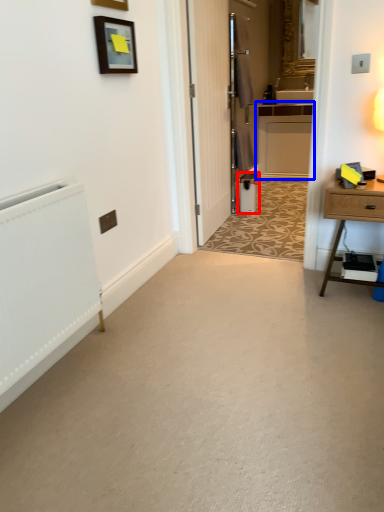
Question: Among these objects, which one is farthest to the camera, appliance (highlighted by a red box) or cabinetry (highlighted by a blue box)?

Choices:
 (A) appliance
 (B) cabinetry

Answer: (B)